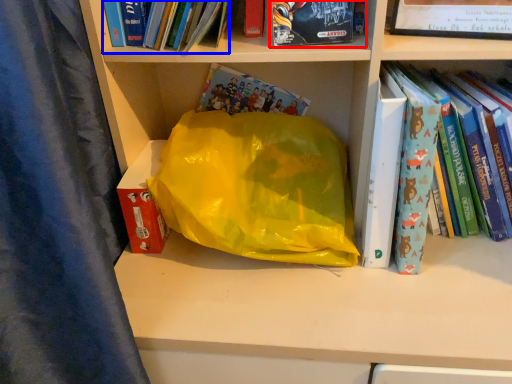
Question: Among these objects, which one is farthest to the camera, book (highlighted by a red box) or book (highlighted by a blue box)?

Choices:
 (A) book
 (B) book

Answer: (A)